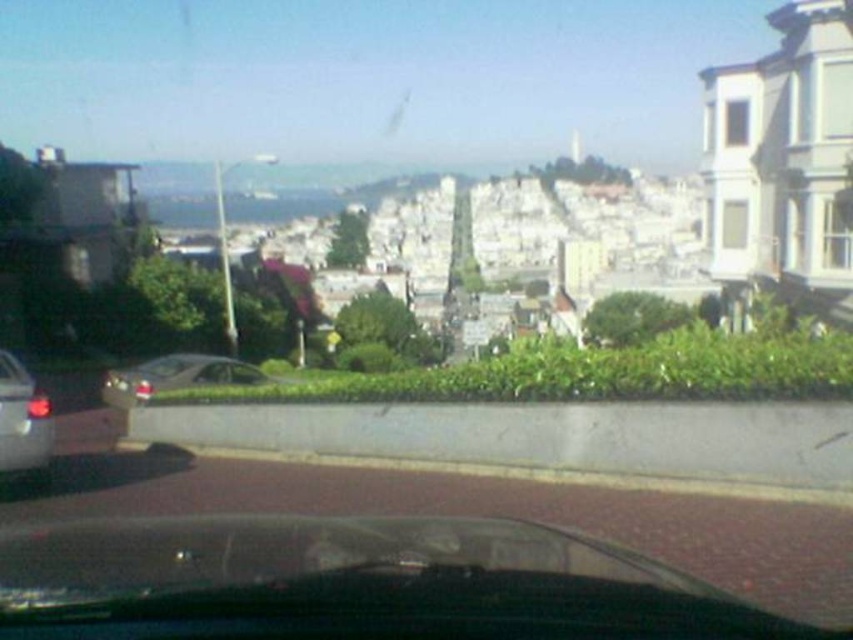
Can you confirm if satin silver sedan at center is positioned to the left of shiny silver car at left?

Indeed, satin silver sedan at center is positioned on the left side of shiny silver car at left.

Is satin silver sedan at center further to camera compared to shiny silver car at left?

Yes, it is.

Does point (154, 371) lie behind point (13, 435)?

That is True.

Locate an element on the screen. This screenshot has height=640, width=853. satin silver sedan at center is located at coordinates (177, 376).